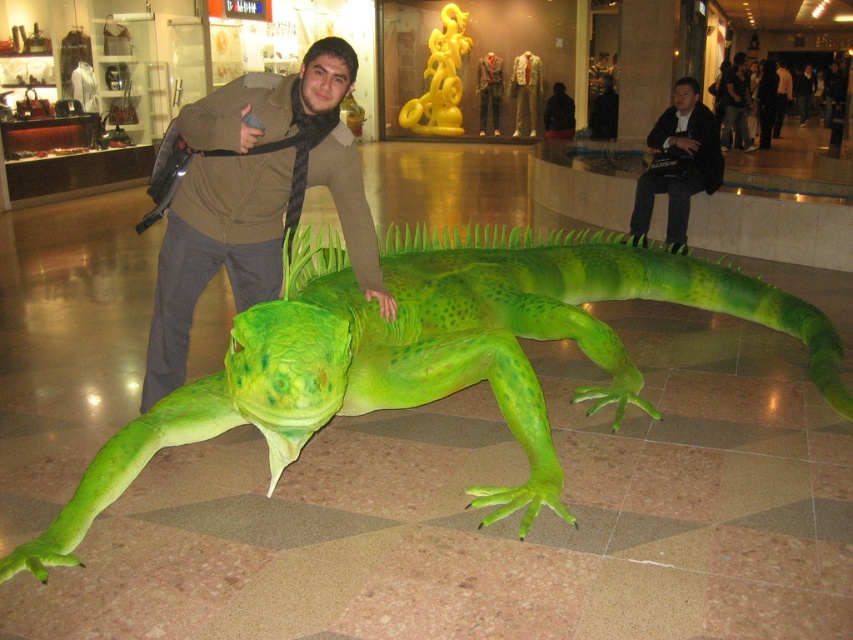
You are standing in the shopping mall and want to take a photo of the large green artificial iguana. You notice there is a point at coordinates (x=283, y=420) that is 2.06 meters away from the camera. If your camera has a maximum focus range of 2 meters, will you be able to focus on the iguana?

The point at coordinates (x=283, y=420) is 2.06 meters away from the camera, which exceeds the maximum focus range of 2 meters. Therefore, the camera will not be able to focus on the iguana at that distance.